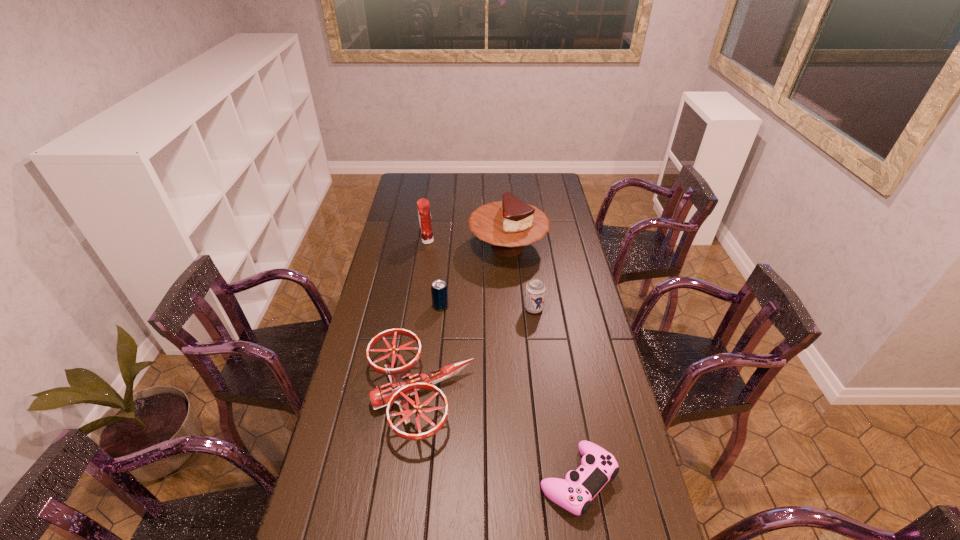
You are a GUI agent. You are given a task and a screenshot of the screen. Output one action in this format:
    pyautogui.click(x=<x>, y=<y>)
    Task: Click on the cake
    
    Given the screenshot: What is the action you would take?
    pyautogui.click(x=509, y=225)

Locate an element on the screen. Image resolution: width=960 pixels, height=540 pixels. condiment is located at coordinates (423, 205).

Image resolution: width=960 pixels, height=540 pixels. Find the location of `beer can`. beer can is located at coordinates (535, 289).

At what (x,y) coordinates should I click in order to perform the action: click on soda can. Please return your answer as a coordinate pair (x, y). This screenshot has width=960, height=540. Looking at the image, I should click on (439, 289).

This screenshot has height=540, width=960. I want to click on drone, so click(402, 384).

The image size is (960, 540). Identify the location of control. (598, 466).

This screenshot has height=540, width=960. Find the location of `vacant space situated 0.150m on the left of the cake`. vacant space situated 0.150m on the left of the cake is located at coordinates (435, 247).

You are a GUI agent. You are given a task and a screenshot of the screen. Output one action in this format:
    pyautogui.click(x=<x>, y=<y>)
    Task: Click on the vacant space located on the front of the condiment
    
    Given the screenshot: What is the action you would take?
    pyautogui.click(x=421, y=281)

Locate an element on the screen. The width and height of the screenshot is (960, 540). vacant space located 0.140m on the right of the beer can is located at coordinates (580, 309).

You are a GUI agent. You are given a task and a screenshot of the screen. Output one action in this format:
    pyautogui.click(x=<x>, y=<y>)
    Task: Click on the vacant area situated on the right of the soda can
    
    Given the screenshot: What is the action you would take?
    pyautogui.click(x=465, y=306)